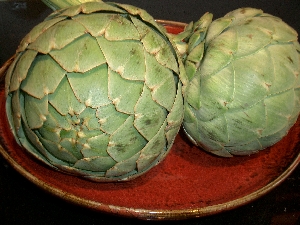
Image resolution: width=300 pixels, height=225 pixels. Identify the location of red plate. (189, 177).